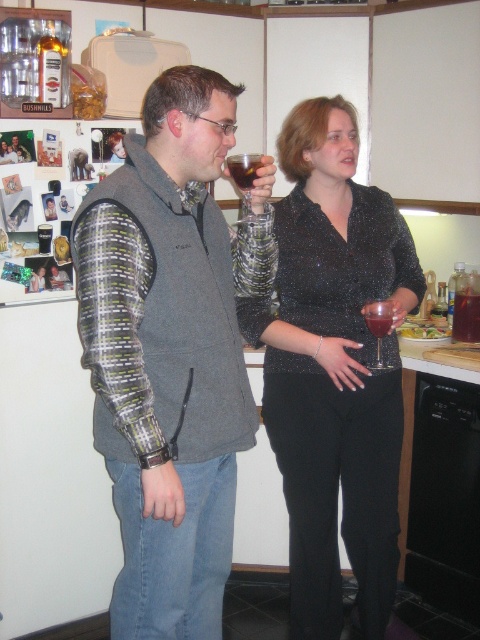
Based on the photo, which of these two, transparent glass at upper center or transparent glass at center, stands taller?

Standing taller between the two is transparent glass at center.

Locate an element on the screen. Image resolution: width=480 pixels, height=640 pixels. transparent glass at upper center is located at coordinates (244, 179).

Locate an element on the screen. Image resolution: width=480 pixels, height=640 pixels. transparent glass at upper center is located at coordinates pyautogui.click(x=244, y=179).

In the scene shown: How much distance is there between gray fleece vest at center and dark red liquid at center?

The distance of gray fleece vest at center from dark red liquid at center is 4.25 feet.

Can you confirm if gray fleece vest at center is bigger than dark red liquid at center?

Yes, gray fleece vest at center is bigger than dark red liquid at center.

Between point (180, 248) and point (454, 317), which one is positioned behind?

The point (454, 317) is behind.

You are a GUI agent. You are given a task and a screenshot of the screen. Output one action in this format:
    pyautogui.click(x=<x>, y=<y>)
    Task: Click on the gray fleece vest at center
    
    Given the screenshot: What is the action you would take?
    pyautogui.click(x=169, y=355)

Who is more forward, (384, 307) or (370, 330)?

Point (384, 307)

Locate an element on the screen. transparent glass at center is located at coordinates (379, 328).

Locate an element on the screen. The height and width of the screenshot is (640, 480). transparent glass at center is located at coordinates (379, 328).